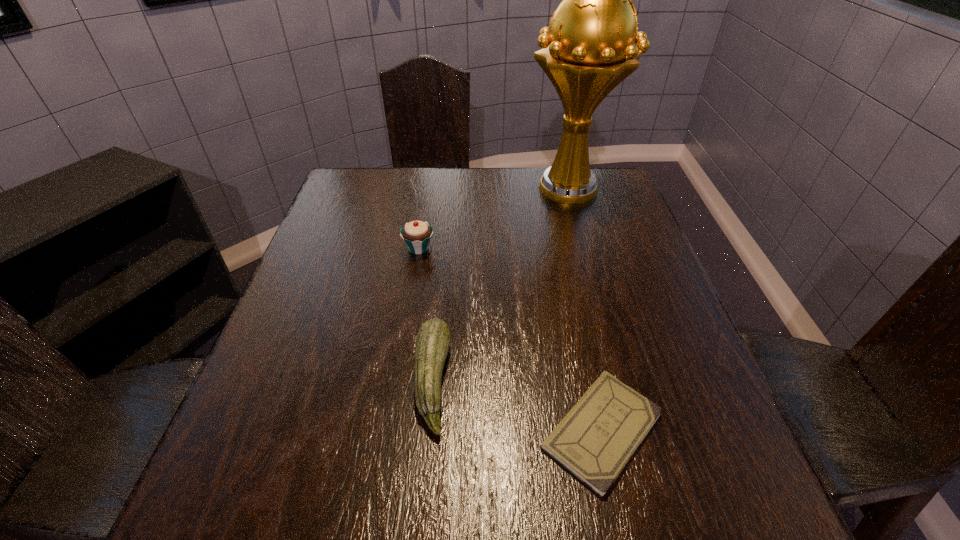
I want to click on object that is at the far edge, so click(x=587, y=50).

Locate an element on the screen. object positioned at the near edge is located at coordinates (595, 440).

Identify the location of trophy_cup that is at the right edge. [587, 50].

You are a GUI agent. You are given a task and a screenshot of the screen. Output one action in this format:
    pyautogui.click(x=<x>, y=<y>)
    Task: Click on the checkbook present at the right edge
    
    Given the screenshot: What is the action you would take?
    pyautogui.click(x=595, y=440)

Where is `object that is at the far right corner`? The height and width of the screenshot is (540, 960). object that is at the far right corner is located at coordinates (587, 50).

Image resolution: width=960 pixels, height=540 pixels. I want to click on object that is at the near right corner, so click(x=595, y=440).

Where is `vacant space at the far edge`? vacant space at the far edge is located at coordinates (486, 183).

Find the location of a particular element. vacant space at the near edge of the desktop is located at coordinates (x=462, y=519).

At what (x,y) coordinates should I click in order to perform the action: click on vacant region at the left edge. Please return your answer as a coordinate pair (x, y). Image resolution: width=960 pixels, height=540 pixels. Looking at the image, I should click on (320, 341).

Where is `vacant space at the right edge of the desktop`? The height and width of the screenshot is (540, 960). vacant space at the right edge of the desktop is located at coordinates (589, 237).